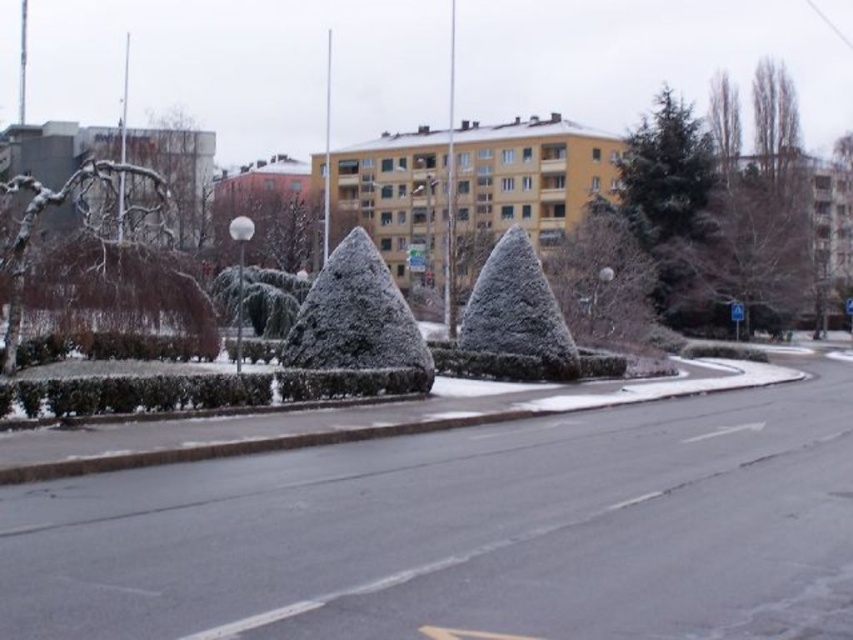
Question: Is frosted green shrub at center to the right of snow-covered branches at upper left from the viewer's perspective?

Choices:
 (A) yes
 (B) no

Answer: (A)

Question: Among these points, which one is nearest to the camera?

Choices:
 (A) (16, 266)
 (B) (310, 291)

Answer: (A)

Question: Does bare brown tree at upper right appear on the left side of snow-covered bush at center?

Choices:
 (A) no
 (B) yes

Answer: (A)

Question: Estimate the real-world distances between objects in this image. Which object is farther from the white snow-covered bush at center?

Choices:
 (A) snow-covered branches at left
 (B) green frosted bush at center

Answer: (A)

Question: Is bare brown tree at upper right in front of frosted green shrub at center?

Choices:
 (A) yes
 (B) no

Answer: (B)

Question: Among these points, which one is nearest to the camera?

Choices:
 (A) (293, 364)
 (B) (258, 284)
 (C) (201, 208)

Answer: (A)